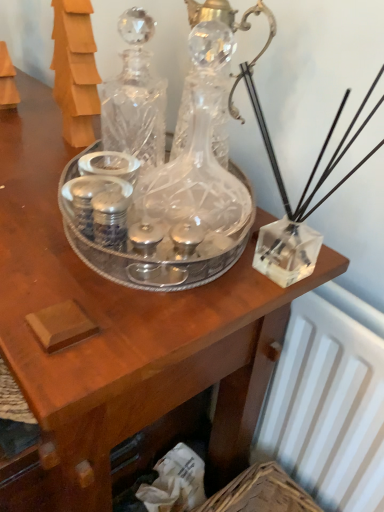
Question: From their relative heights in the image, would you say clear crystal decanter at center, positioned as the first glass bottle in back-to-front order, is taller or shorter than transparent crystal decanter at center, which appears as the second glass bottle when viewed from the back?

Choices:
 (A) tall
 (B) short

Answer: (B)

Question: Is clear crystal decanter at center, positioned as the first glass bottle in back-to-front order, inside the boundaries of transparent crystal decanter at center, which ranks as the 1th glass bottle in front-to-back order, or outside?

Choices:
 (A) inside
 (B) outside

Answer: (B)

Question: Does point (162, 126) appear closer or farther from the camera than point (231, 204)?

Choices:
 (A) farther
 (B) closer

Answer: (A)

Question: Is point (208, 239) closer or farther from the camera than point (150, 123)?

Choices:
 (A) farther
 (B) closer

Answer: (B)

Question: Is transparent crystal decanter at center, which appears as the second glass bottle when viewed from the back, bigger or smaller than clear crystal decanter at center, which appears as the 2th glass bottle when viewed from the front?

Choices:
 (A) big
 (B) small

Answer: (A)

Question: Is transparent crystal decanter at center, which ranks as the 1th glass bottle in front-to-back order, in front of or behind clear crystal decanter at center, positioned as the first glass bottle in back-to-front order, in the image?

Choices:
 (A) behind
 (B) front

Answer: (B)

Question: From their relative heights in the image, would you say transparent crystal decanter at center, which appears as the second glass bottle when viewed from the back, is taller or shorter than clear crystal decanter at center, positioned as the first glass bottle in back-to-front order?

Choices:
 (A) short
 (B) tall

Answer: (B)